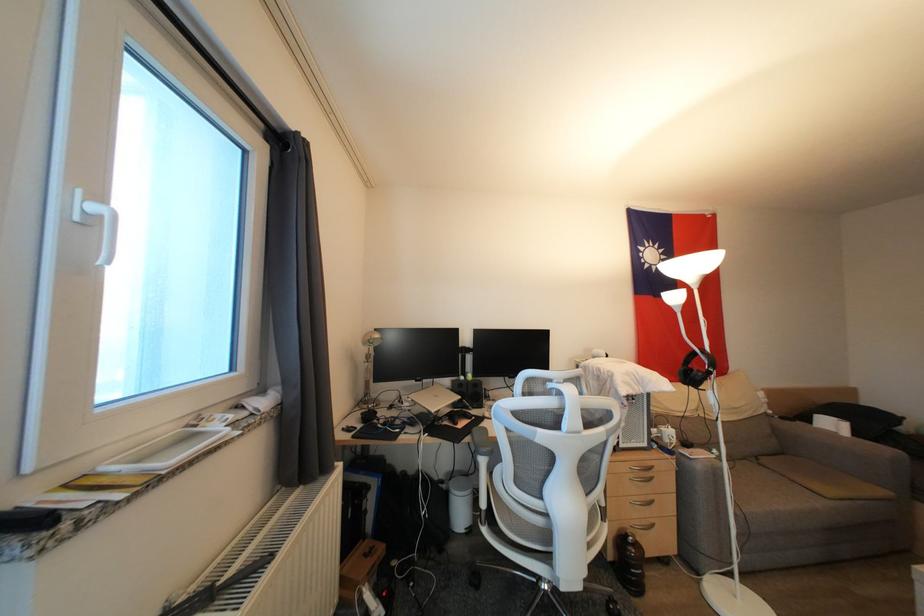
The image size is (924, 616). Find the location of `chair sitting surface`. chair sitting surface is located at coordinates (578, 545).